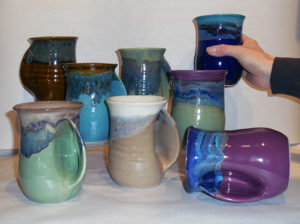
Find the location of `pottery`. pottery is located at coordinates (142, 131), (39, 129), (105, 95), (50, 66), (146, 69), (201, 99), (218, 32), (251, 166).